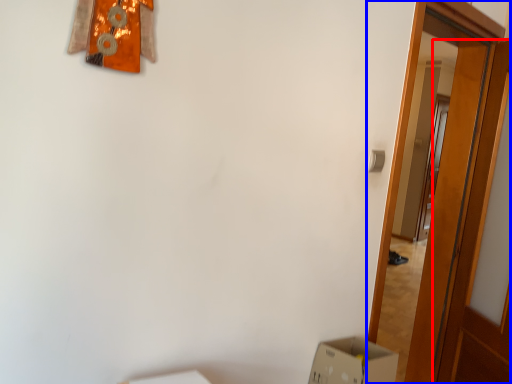
Question: Which of the following is the farthest to the observer, door (highlighted by a red box) or door (highlighted by a blue box)?

Choices:
 (A) door
 (B) door

Answer: (A)